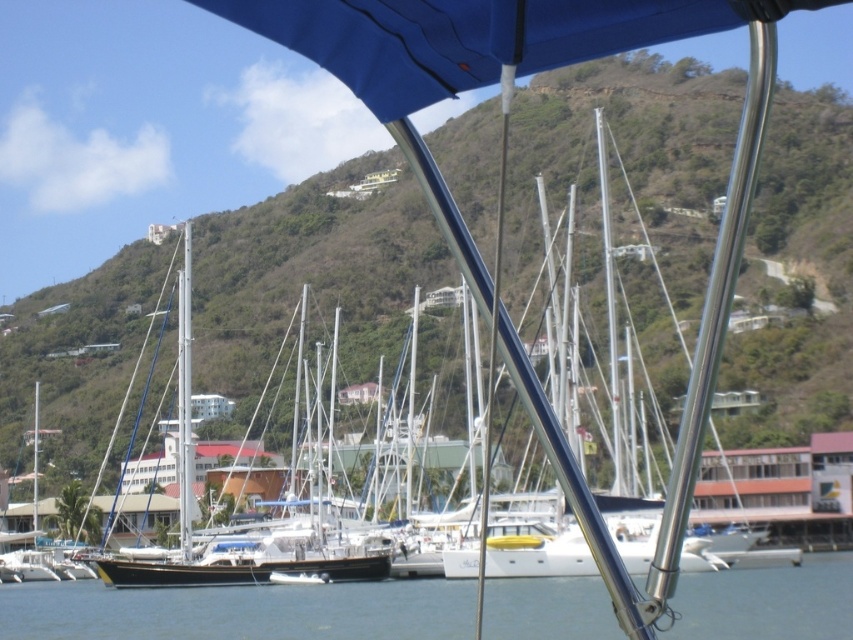
Question: Which point is closer to the camera taking this photo?

Choices:
 (A) (223, 385)
 (B) (283, 627)

Answer: (B)

Question: Does green leafy hillside at center have a lesser width compared to clear blue water at lower center?

Choices:
 (A) no
 (B) yes

Answer: (A)

Question: From the image, what is the correct spatial relationship of green leafy hillside at center in relation to clear blue water at lower center?

Choices:
 (A) above
 (B) below

Answer: (A)

Question: Is green leafy hillside at center thinner than clear blue water at lower center?

Choices:
 (A) no
 (B) yes

Answer: (A)